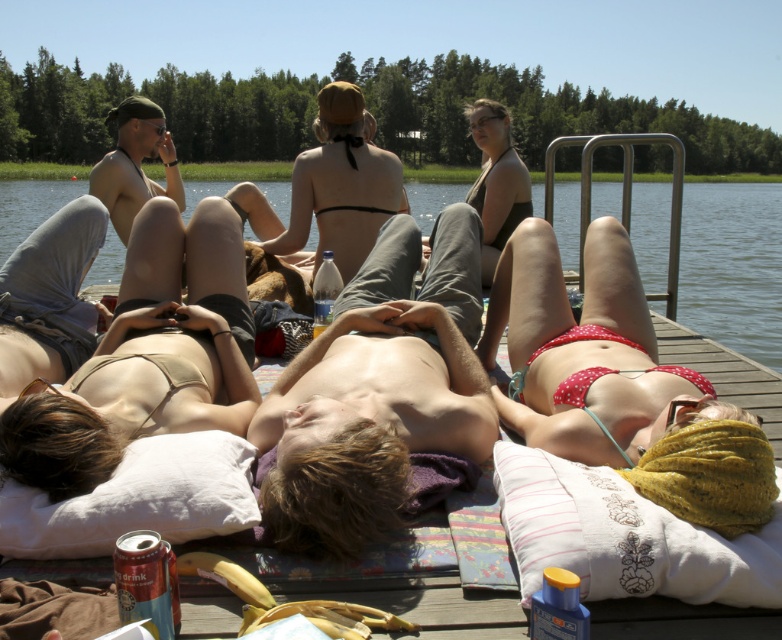
Question: Which of the following is the closest to the observer?

Choices:
 (A) white embroidered pillow at lower right
 (B) matte black bikini at center

Answer: (A)

Question: Which of the following is the farthest from the observer?

Choices:
 (A) transparent water at center
 (B) polka dot bikini at center
 (C) black bikini at center

Answer: (C)

Question: Does beige fabric bikini top at lower left appear on the right side of white embroidered pillow at lower right?

Choices:
 (A) yes
 (B) no

Answer: (B)

Question: Can you confirm if polka dot bikini at center is positioned above white embroidered pillow at lower right?

Choices:
 (A) no
 (B) yes

Answer: (B)

Question: Which object appears closest to the camera in this image?

Choices:
 (A) transparent water at center
 (B) polka dot bikini at center
 (C) black bikini at center

Answer: (B)

Question: Is transparent water at center further to the viewer compared to matte black bikini at center?

Choices:
 (A) no
 (B) yes

Answer: (A)